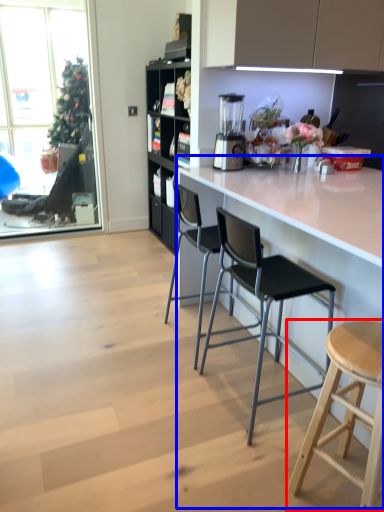
Question: Which of the following is the farthest to the observer, stool (highlighted by a red box) or counter (highlighted by a blue box)?

Choices:
 (A) stool
 (B) counter

Answer: (A)